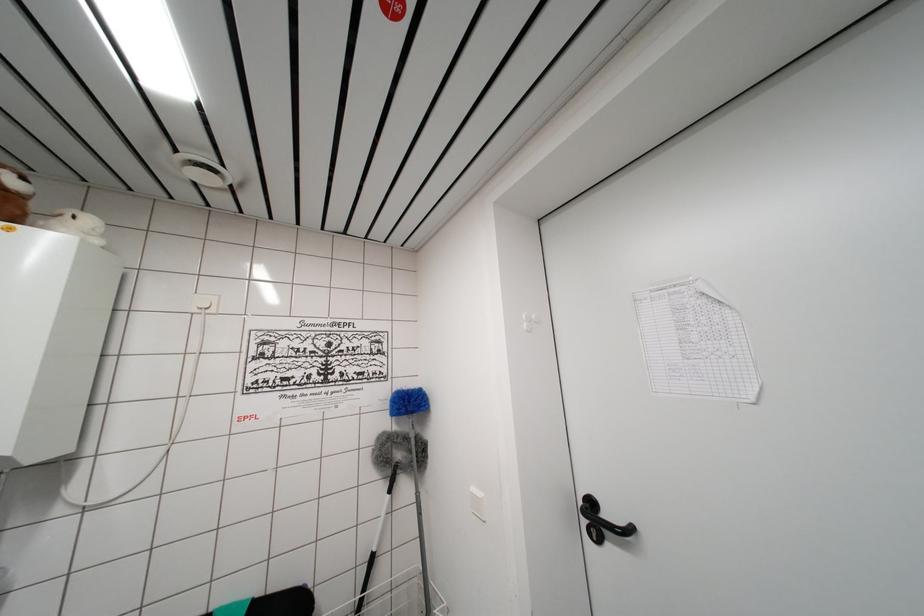
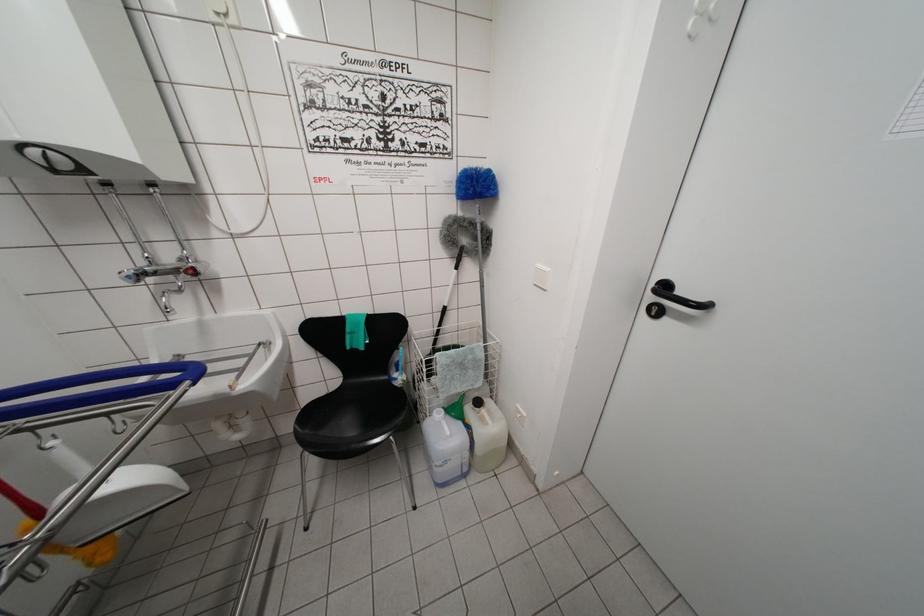
The point at (599, 543) is marked in the first image. Where is the corresponding point in the second image?

(657, 318)